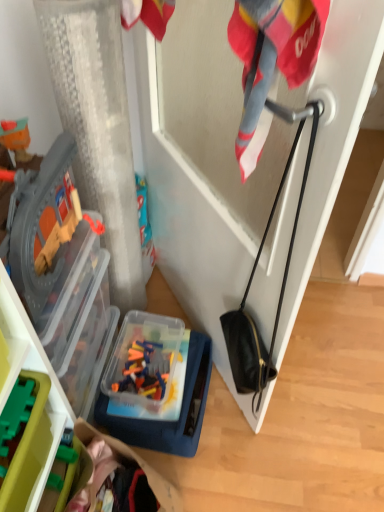
What are the coordinates of `vacant space situated above translucent plastic container at lower center (from a real-world perspective)` in the screenshot? It's located at (161, 373).